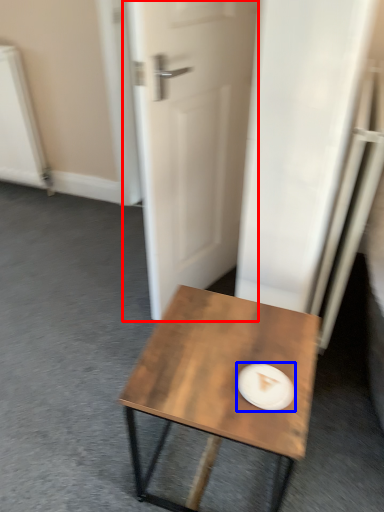
Question: Which of the following is the farthest to the observer, door (highlighted by a red box) or paper plate (highlighted by a blue box)?

Choices:
 (A) door
 (B) paper plate

Answer: (A)